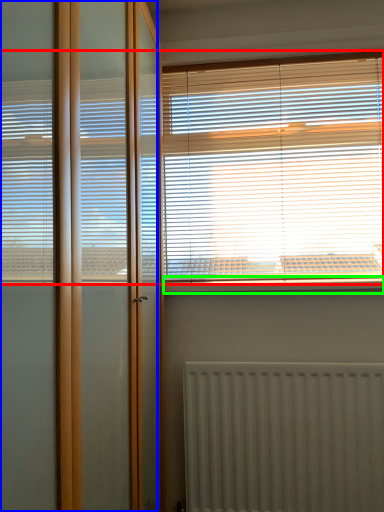
Question: Based on their relative distances, which object is farther from window blind (highlighted by a red box)? Choose from screen door (highlighted by a blue box) and window sill (highlighted by a green box).

Choices:
 (A) screen door
 (B) window sill

Answer: (A)